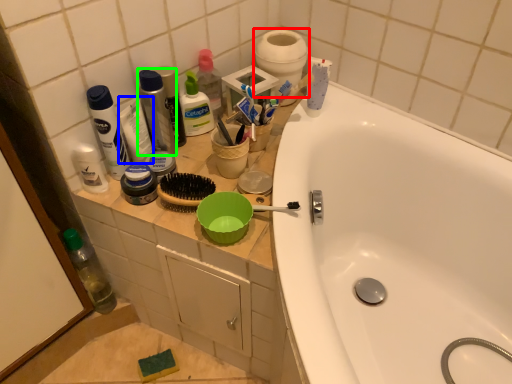
Question: Estimate the real-world distances between objects in this image. Which object is closer to toilet paper (highlighted by a red box), toothpaste (highlighted by a blue box) or mouthwash (highlighted by a green box)?

Choices:
 (A) toothpaste
 (B) mouthwash

Answer: (B)